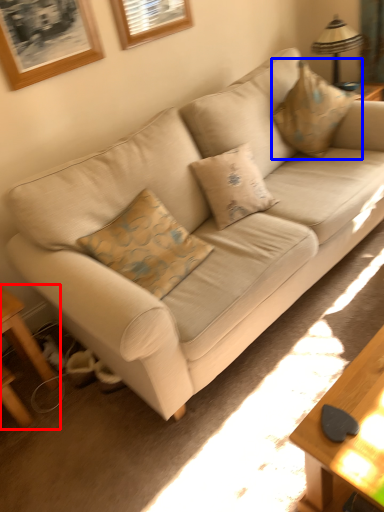
Question: Which of the following is the farthest to the observer, table (highlighted by a red box) or throw pillow (highlighted by a blue box)?

Choices:
 (A) table
 (B) throw pillow

Answer: (B)